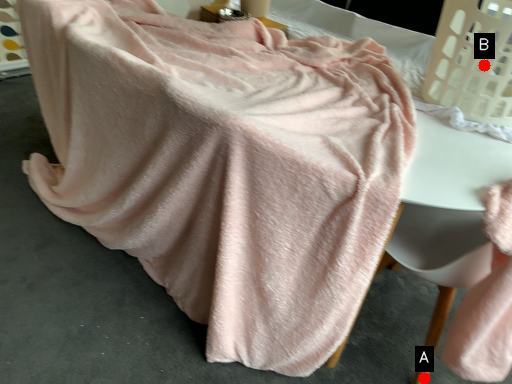
Question: Two points are circled on the image, labeled by A and B beside each circle. Among these points, which one is farthest from the camera?

Choices:
 (A) A is further
 (B) B is further

Answer: (A)